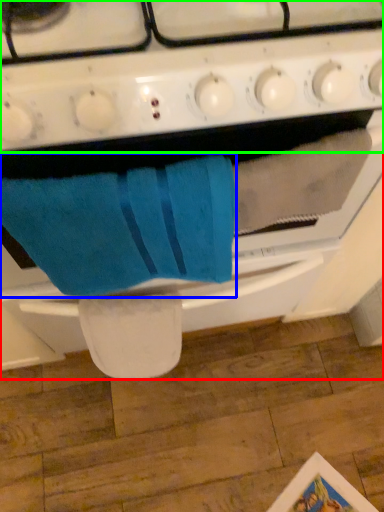
Question: Which object is the farthest from oven (highlighted by a red box)? Choose among these: bath towel (highlighted by a blue box) or gas stove (highlighted by a green box).

Choices:
 (A) bath towel
 (B) gas stove

Answer: (B)